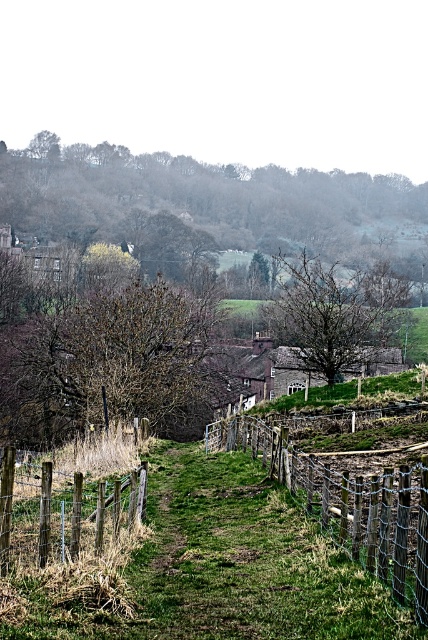
Question: Which object appears closest to the camera in this image?

Choices:
 (A) brown leafless tree at upper center
 (B) bare branches at center
 (C) brown leafy tree at center
 (D) wooden wire fence at center

Answer: (D)

Question: Is brown leafy tree at center to the right of bare branches at center from the viewer's perspective?

Choices:
 (A) yes
 (B) no

Answer: (B)

Question: Is brown leafy tree at center to the right of brown wooden fence at lower left from the viewer's perspective?

Choices:
 (A) yes
 (B) no

Answer: (B)

Question: Observing the image, what is the correct spatial positioning of bare branches at center in reference to brown wooden fence at lower left?

Choices:
 (A) above
 (B) below

Answer: (A)

Question: Which of these objects is positioned closest to the brown leafy tree at center?

Choices:
 (A) bare branches at center
 (B) brown wooden fence at lower left

Answer: (A)

Question: Which object is positioned closest to the brown wooden fence at lower left?

Choices:
 (A) bare branches at center
 (B) wooden wire fence at center
 (C) brown leafless tree at upper center

Answer: (B)